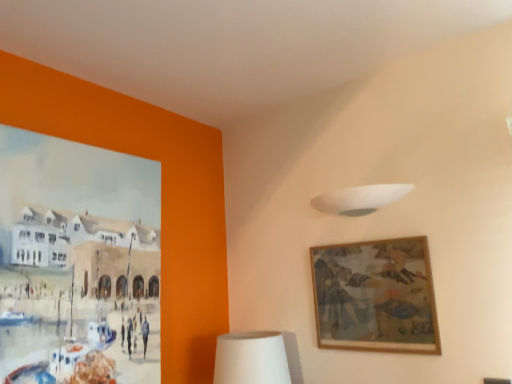
Question: Is white matte lampshade at upper center bigger or smaller than wooden framed artwork at upper right?

Choices:
 (A) small
 (B) big

Answer: (A)

Question: From their relative heights in the image, would you say white matte lampshade at upper center is taller or shorter than wooden framed artwork at upper right?

Choices:
 (A) short
 (B) tall

Answer: (A)

Question: Which is nearer to the white matte lampshade at upper center?

Choices:
 (A) white matte table lamp at lower center
 (B) wooden framed artwork at upper right

Answer: (B)

Question: Estimate the real-world distances between objects in this image. Which object is closer to the white matte lampshade at upper center?

Choices:
 (A) wooden framed artwork at upper right
 (B) white matte table lamp at lower center

Answer: (A)